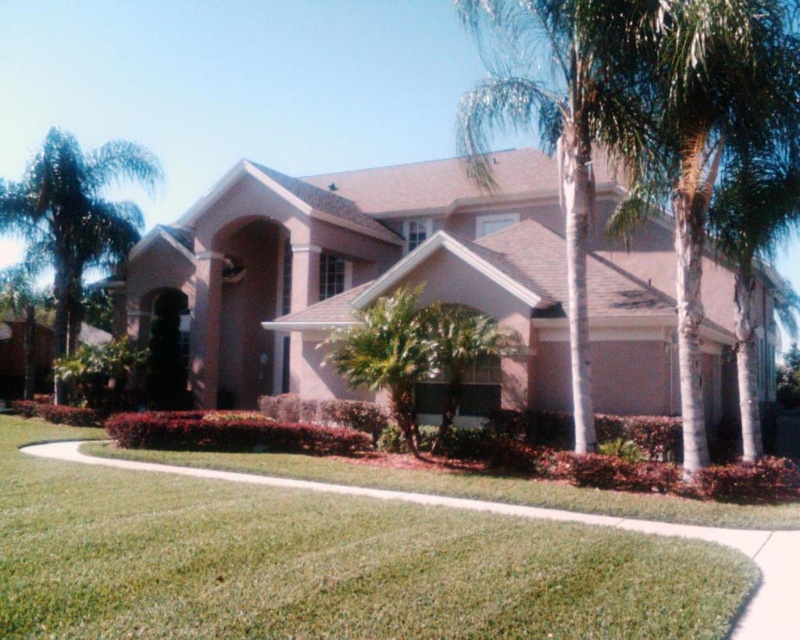
You are standing at the camera position facing the house. There is a point marked at coordinates point (126, 618). Can you reach this point without moving past the front lawn? The front lawn is the area in front of the house up to the pathway.

The point (126, 618) is 5.70 meters away from the camera. Since the front lawn extends up to the pathway, which is in front of the house, you can reach this point by walking forward from the camera position within the lawn area without crossing the pathway.

You are standing at the entrance of the house and want to walk to the green leafy palm tree at left. Which direction should you turn to reach it from the green grass at center?

The green grass at center is to the right of the green leafy palm tree at left, so you should turn left to reach the green leafy palm tree at left from the green grass at center.